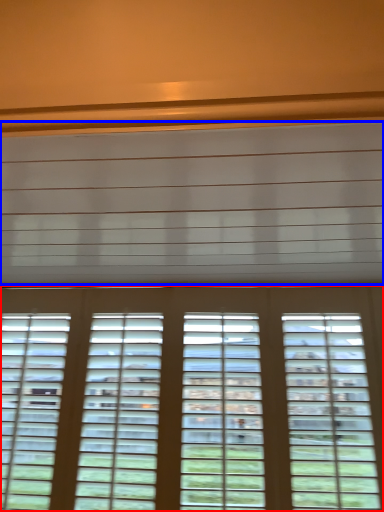
Question: Which of the following is the farthest to the observer, window (highlighted by a red box) or blind (highlighted by a blue box)?

Choices:
 (A) window
 (B) blind

Answer: (A)